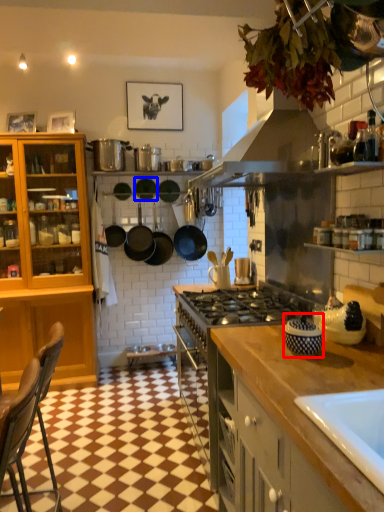
Question: Which object is closer to the camera taking this photo, appliance (highlighted by a red box) or frying pan (highlighted by a blue box)?

Choices:
 (A) appliance
 (B) frying pan

Answer: (A)